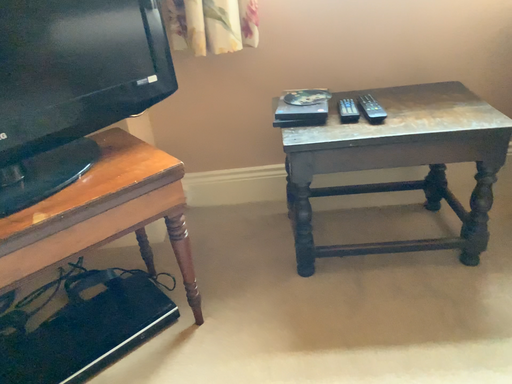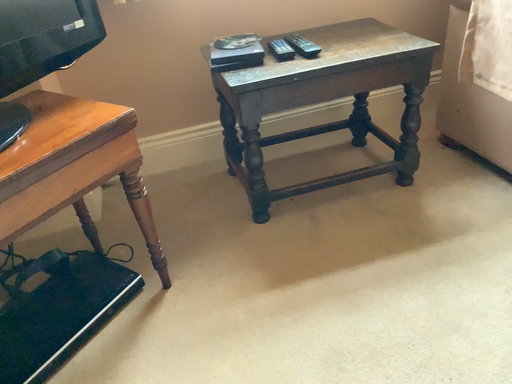
Question: How did the camera likely rotate when shooting the video?

Choices:
 (A) rotated left
 (B) rotated right

Answer: (B)